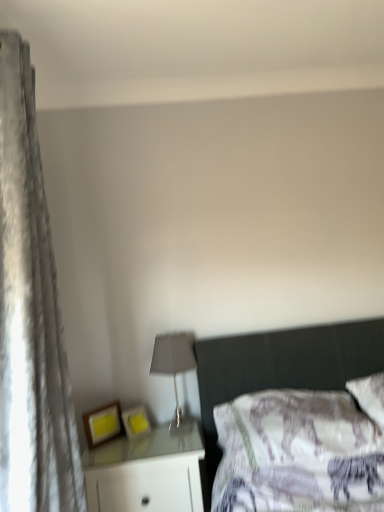
Question: Considering the relative sizes of matte wooden picture frame at lower left, which ranks as the 2th picture frame in right-to-left order, and matte gray lampshade at center in the image provided, is matte wooden picture frame at lower left, which ranks as the 2th picture frame in right-to-left order, taller than matte gray lampshade at center?

Choices:
 (A) no
 (B) yes

Answer: (A)

Question: Is matte wooden picture frame at lower left, which ranks as the 2th picture frame in right-to-left order, positioned before matte gray lampshade at center?

Choices:
 (A) no
 (B) yes

Answer: (B)

Question: Is matte wooden picture frame at lower left, which is the first picture frame in left-to-right order, bigger than matte gray lampshade at center?

Choices:
 (A) yes
 (B) no

Answer: (B)

Question: Is matte wooden picture frame at lower left, which ranks as the 2th picture frame in right-to-left order, thinner than matte gray lampshade at center?

Choices:
 (A) no
 (B) yes

Answer: (B)

Question: From the image's perspective, is matte wooden picture frame at lower left, which ranks as the 2th picture frame in right-to-left order, above matte gray lampshade at center?

Choices:
 (A) yes
 (B) no

Answer: (B)

Question: From a real-world perspective, relative to matte gray lampshade at center, is matte yellow picture frame at lower center, the 1th picture frame when ordered from right to left, vertically above or below?

Choices:
 (A) above
 (B) below

Answer: (B)

Question: Would you say matte yellow picture frame at lower center, the 1th picture frame when ordered from right to left, is to the left or to the right of matte gray lampshade at center in the picture?

Choices:
 (A) right
 (B) left

Answer: (B)

Question: In terms of size, does matte yellow picture frame at lower center, the 1th picture frame when ordered from right to left, appear bigger or smaller than matte gray lampshade at center?

Choices:
 (A) small
 (B) big

Answer: (A)

Question: Is matte yellow picture frame at lower center, the 2th picture frame in the left-to-right sequence, taller or shorter than matte gray lampshade at center?

Choices:
 (A) short
 (B) tall

Answer: (A)

Question: Is velvet gray curtain at left spatially inside matte wooden picture frame at lower left, which is the first picture frame in left-to-right order, or outside of it?

Choices:
 (A) inside
 (B) outside

Answer: (B)

Question: Is point (49, 367) closer or farther from the camera than point (102, 408)?

Choices:
 (A) farther
 (B) closer

Answer: (B)

Question: In the image, is velvet gray curtain at left on the left side or the right side of matte wooden picture frame at lower left, which is the first picture frame in left-to-right order?

Choices:
 (A) left
 (B) right

Answer: (A)

Question: Based on their sizes in the image, would you say velvet gray curtain at left is bigger or smaller than matte wooden picture frame at lower left, which ranks as the 2th picture frame in right-to-left order?

Choices:
 (A) small
 (B) big

Answer: (B)

Question: Is white glossy nightstand at lower left spatially inside matte wooden picture frame at lower left, which is the first picture frame in left-to-right order, or outside of it?

Choices:
 (A) outside
 (B) inside

Answer: (A)

Question: Considering their positions, is white glossy nightstand at lower left located in front of or behind matte wooden picture frame at lower left, which ranks as the 2th picture frame in right-to-left order?

Choices:
 (A) front
 (B) behind

Answer: (A)